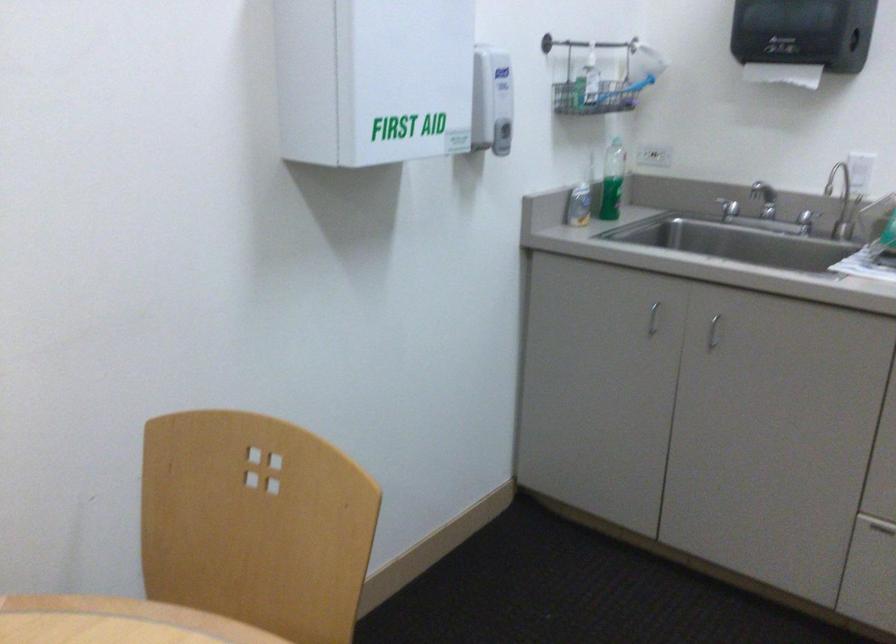
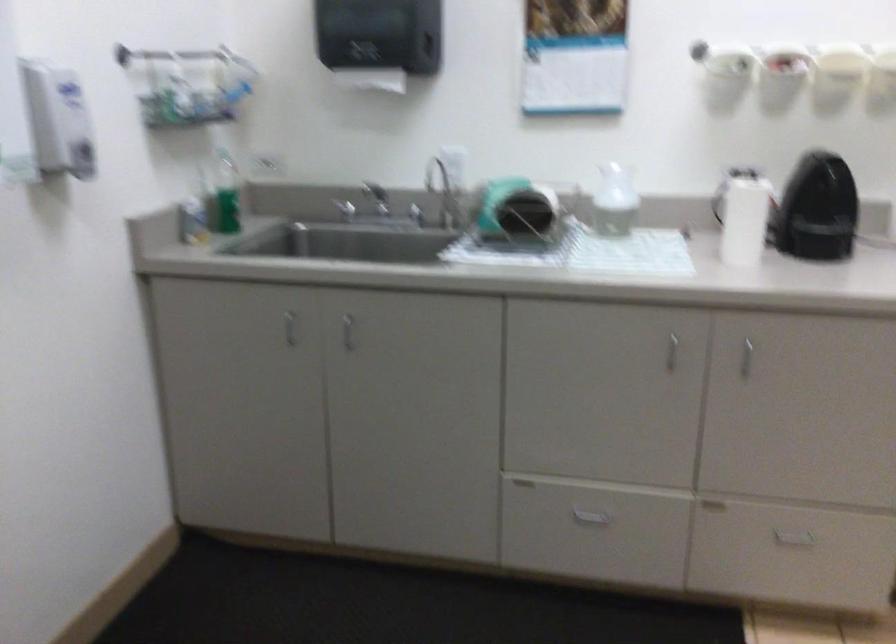
Question: The camera is either moving clockwise (left) or counter-clockwise (right) around the object. The first image is from the beginning of the video and the second image is from the end. Is the camera moving left or right when shooting the video?

Choices:
 (A) Left
 (B) Right

Answer: (A)